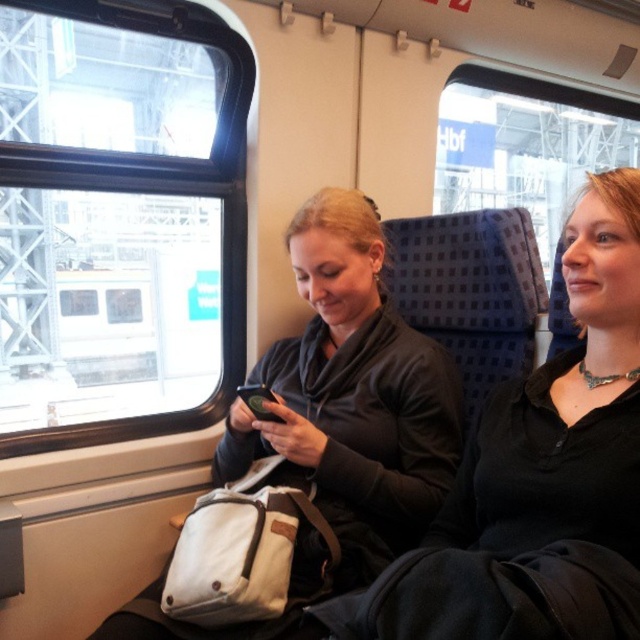
Based on the photo, you are a photographer standing 30 inches away from the camera. You want to take a photo of the black matte jacket at center without moving the camera. Is the jacket within your reach to adjust its position?

The black matte jacket at center is 28.03 inches away from the camera, so it is within your 30 inches reach. You can adjust its position without moving the camera.

You are a passenger on the train and want to see the view outside. You have the transparent glass window at upper left and the matte black jacket at center in your sight. Which object is higher in your field of view?

The transparent glass window at upper left is above matte black jacket at center, so it is higher in your field of view.